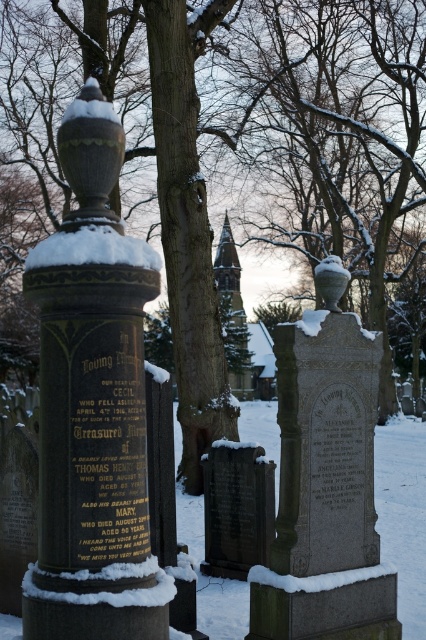
Question: Among these objects, which one is farthest from the camera?

Choices:
 (A) white fluffy snow at top
 (B) granite gravestone at center
 (C) bronze plaque at center
 (D) dark gray stone gravestone at center

Answer: (D)

Question: Is bronze plaque at center above dark gray stone gravestone at center?

Choices:
 (A) yes
 (B) no

Answer: (A)

Question: Which point is closer to the camera?

Choices:
 (A) dark gray stone gravestone at center
 (B) white fluffy snow at top
 (C) granite gravestone at center

Answer: (B)

Question: Is bronze plaque at center to the right of dark gray stone gravestone at center from the viewer's perspective?

Choices:
 (A) yes
 (B) no

Answer: (B)

Question: In this image, where is bronze plaque at center located relative to dark gray stone gravestone at center?

Choices:
 (A) below
 (B) above

Answer: (B)

Question: Which object is closer to the camera taking this photo?

Choices:
 (A) granite gravestone at center
 (B) bronze plaque at center
 (C) white fluffy snow at top

Answer: (C)